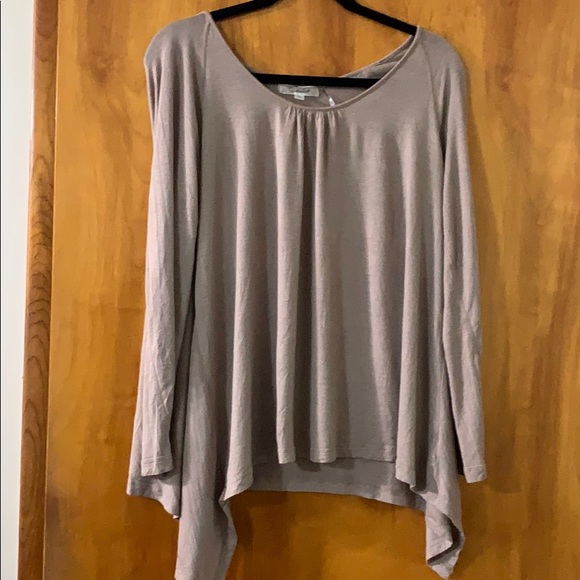
What are the coordinates of `wooden door` in the screenshot? It's located at (107, 232).